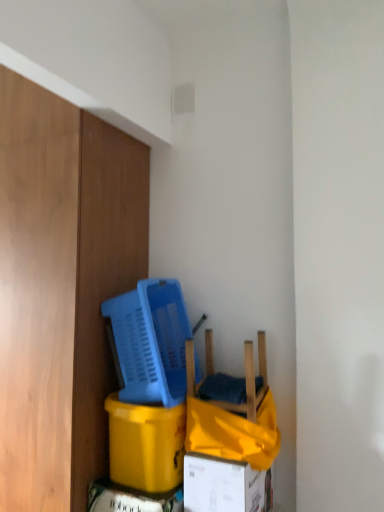
Question: Considering the relative positions of blue plastic basket at center and yellow cardboard box at lower left in the image provided, is blue plastic basket at center to the left of yellow cardboard box at lower left from the viewer's perspective?

Choices:
 (A) yes
 (B) no

Answer: (A)

Question: From the image's perspective, is blue plastic basket at center above yellow cardboard box at lower left?

Choices:
 (A) no
 (B) yes

Answer: (B)

Question: Does blue plastic basket at center have a lesser width compared to yellow cardboard box at lower left?

Choices:
 (A) no
 (B) yes

Answer: (A)

Question: Is blue plastic basket at center facing towards yellow cardboard box at lower left?

Choices:
 (A) yes
 (B) no

Answer: (B)

Question: Is blue plastic basket at center far from yellow cardboard box at lower left?

Choices:
 (A) no
 (B) yes

Answer: (A)

Question: From the image's perspective, does blue plastic basket at center appear lower than yellow cardboard box at lower left?

Choices:
 (A) no
 (B) yes

Answer: (A)

Question: Is the position of wooden chair at lower center more distant than that of yellow cardboard box at lower left?

Choices:
 (A) no
 (B) yes

Answer: (A)

Question: Does wooden chair at lower center touch yellow cardboard box at lower left?

Choices:
 (A) yes
 (B) no

Answer: (B)

Question: Can you confirm if wooden chair at lower center is thinner than yellow cardboard box at lower left?

Choices:
 (A) no
 (B) yes

Answer: (B)

Question: From the image's perspective, would you say wooden chair at lower center is shown under yellow cardboard box at lower left?

Choices:
 (A) yes
 (B) no

Answer: (B)

Question: Does wooden chair at lower center have a larger size compared to yellow cardboard box at lower left?

Choices:
 (A) no
 (B) yes

Answer: (A)

Question: Is yellow cardboard box at lower left inside wooden chair at lower center?

Choices:
 (A) yes
 (B) no

Answer: (B)

Question: Is yellow cardboard box at lower left bigger than blue plastic basket at center?

Choices:
 (A) no
 (B) yes

Answer: (A)